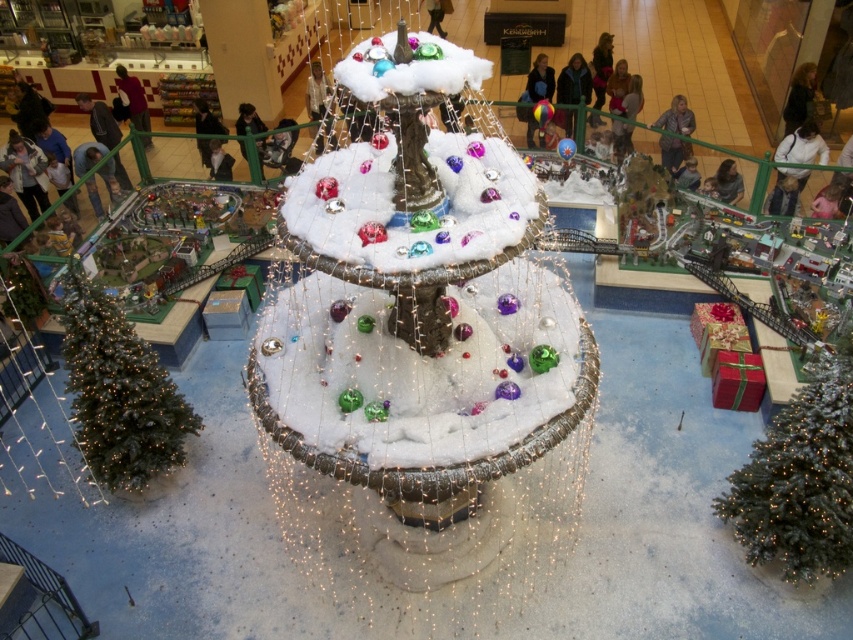
Is green matte christmas tree at lower right taller than green matte christmas tree at lower left?

Indeed, green matte christmas tree at lower right has a greater height compared to green matte christmas tree at lower left.

Is point (764, 433) closer to camera compared to point (97, 426)?

That is False.

At what (x,y) coordinates should I click in order to perform the action: click on green matte christmas tree at lower right. Please return your answer as a coordinate pair (x, y). Looking at the image, I should click on (799, 477).